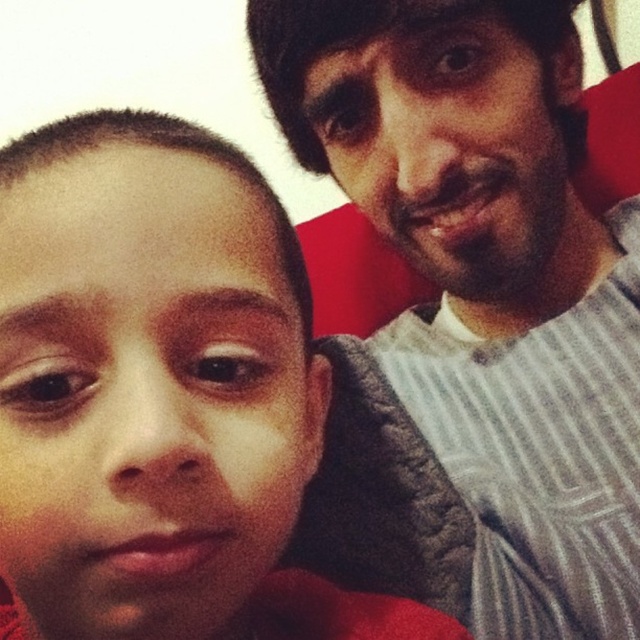
Question: Which point appears farthest from the camera in this image?

Choices:
 (A) (144, 176)
 (B) (401, 385)

Answer: (B)

Question: Which object is farther from the camera taking this photo?

Choices:
 (A) gray striped shirt at upper right
 (B) matte skin child at center

Answer: (A)

Question: Observing the image, what is the correct spatial positioning of gray striped shirt at upper right in reference to matte skin child at center?

Choices:
 (A) above
 (B) below

Answer: (A)

Question: Which point is farther from the camera taking this photo?

Choices:
 (A) (509, 298)
 (B) (273, 522)

Answer: (A)

Question: Is gray striped shirt at upper right to the left of matte skin child at center from the viewer's perspective?

Choices:
 (A) no
 (B) yes

Answer: (A)

Question: Does gray striped shirt at upper right lie behind matte skin child at center?

Choices:
 (A) yes
 (B) no

Answer: (A)